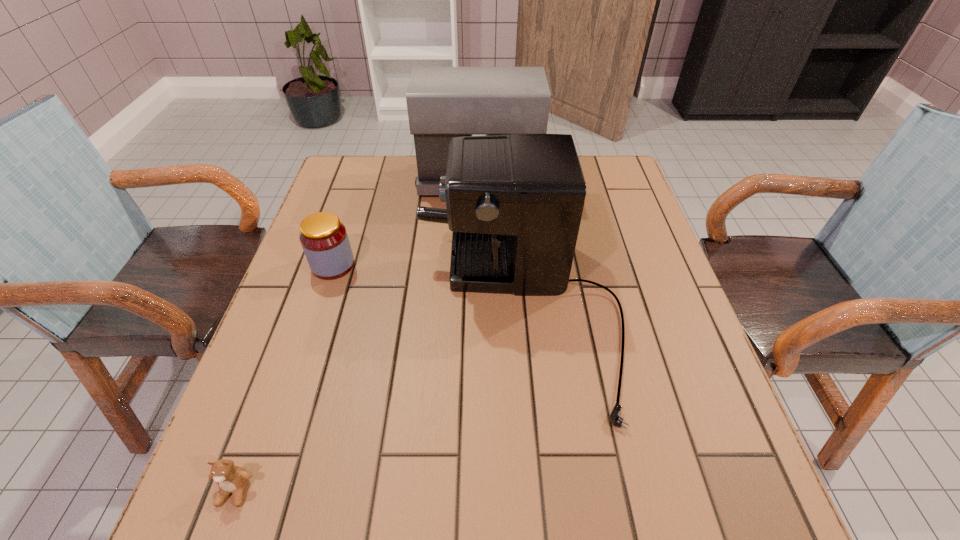
The height and width of the screenshot is (540, 960). Identify the location of vacant space at the far right corner. coord(612,158).

The width and height of the screenshot is (960, 540). I want to click on blank region between the teddy bear and the farthest object, so click(x=357, y=335).

This screenshot has width=960, height=540. I want to click on free point between the farthest object and the second shortest object, so click(x=406, y=222).

Identify the location of vacant point located between the farthest object and the jar. (406, 222).

Locate an element on the screen. Image resolution: width=960 pixels, height=540 pixels. free spot between the teddy bear and the third tallest object is located at coordinates (284, 378).

Where is `vacant space that is in between the nearer coffee maker and the teddy bear`? This screenshot has width=960, height=540. vacant space that is in between the nearer coffee maker and the teddy bear is located at coordinates (376, 402).

This screenshot has width=960, height=540. What are the coordinates of `free space between the shortest object and the farther coffee maker` in the screenshot? It's located at (357, 335).

You are a GUI agent. You are given a task and a screenshot of the screen. Output one action in this format:
    pyautogui.click(x=<x>, y=<y>)
    Task: Click on the free point between the jar and the farthest object
    The height and width of the screenshot is (540, 960).
    Given the screenshot: What is the action you would take?
    (406, 222)

Where is `object that stands as the closest to the jar`? The height and width of the screenshot is (540, 960). object that stands as the closest to the jar is located at coordinates (514, 202).

Choose which object is the nearest neighbor to the farther coffee maker. Please provide its 2D coordinates. Your answer should be formatted as a tuple, i.e. [(x, y)], where the tuple contains the x and y coordinates of a point satisfying the conditions above.

[(514, 202)]